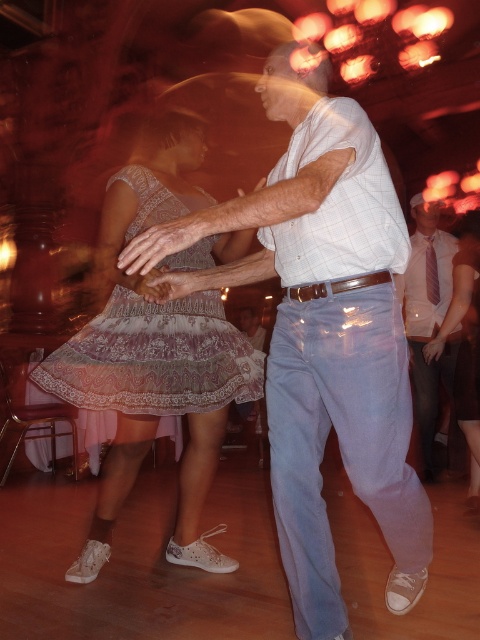
You are at a party and want to take a photo of the dancing couple. The camera you have can only focus on objects wider than 15 cm. Based on the scene, will the white checkered shirt at center and the pink striped tie at center both be in focus?

The white checkered shirt at center is wider than the pink striped tie at center. Since the camera focuses on objects wider than 15 cm, only the white checkered shirt at center will be in focus.

Based on the photo, in the dance scene, there is a point at coordinates (323,333). What object is located at this point?

The point at coordinates (323,333) indicates the white checkered shirt at center.

You are a photographer at the event and want to capture a photo of both the white lace dress at center and the lace fabric skirt at center in the same frame. Your camera has a minimum focus distance of 1.5 meters. Will you be able to take the photo without moving closer?

The distance between the white lace dress at center and the lace fabric skirt at center is 1.40 meters, which is less than the camera minimum focus distance of 1.5 meters. Therefore, you can take the photo without moving closer.